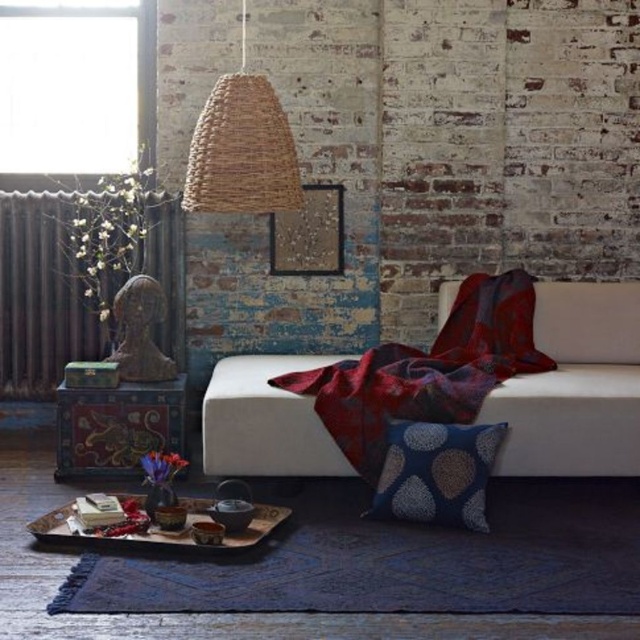
Question: Is transparent glass window at upper left below woven natural fiber pendant light at upper center?

Choices:
 (A) no
 (B) yes

Answer: (A)

Question: Does velvet red blanket at center appear on the right side of woven natural fiber pendant light at upper center?

Choices:
 (A) no
 (B) yes

Answer: (B)

Question: Among these objects, which one is nearest to the camera?

Choices:
 (A) wooden tray at lower center
 (B) woven natural fiber pendant light at upper center

Answer: (A)

Question: Considering the real-world distances, which object is closest to the transparent glass window at upper left?

Choices:
 (A) blue dotted pillow at lower center
 (B) woven natural fiber pendant light at upper center
 (C) painted wood trunk at lower left

Answer: (B)

Question: Is velvet red blanket at center to the right of wooden tray at lower center from the viewer's perspective?

Choices:
 (A) yes
 (B) no

Answer: (A)

Question: Among these points, which one is farthest from the camera?

Choices:
 (A) (371, 465)
 (B) (273, 504)

Answer: (B)